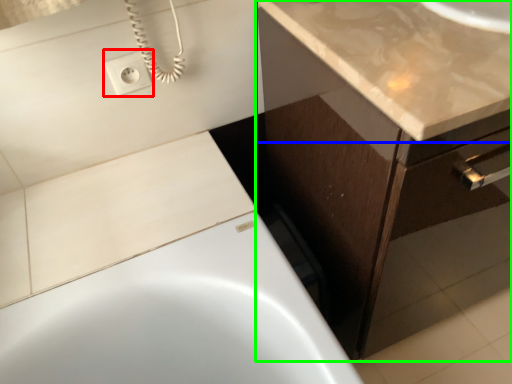
Question: Estimate the real-world distances between objects in this image. Which object is closer to electric outlet (highlighted by a red box), countertop (highlighted by a blue box) or bathroom cabinet (highlighted by a green box)?

Choices:
 (A) countertop
 (B) bathroom cabinet

Answer: (A)